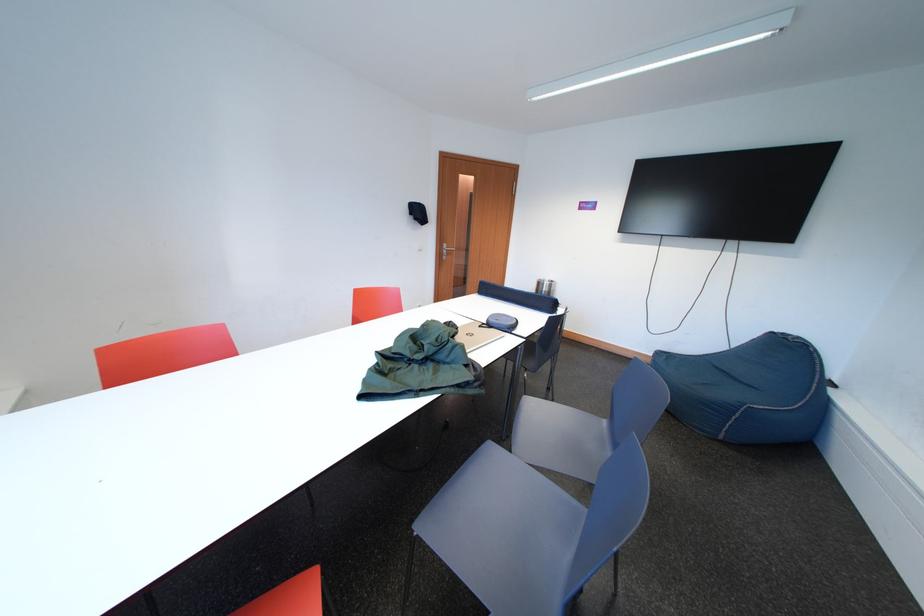
Where would you pull the metal door handle? Please return your answer as a coordinate pair (x, y).

(444, 251)